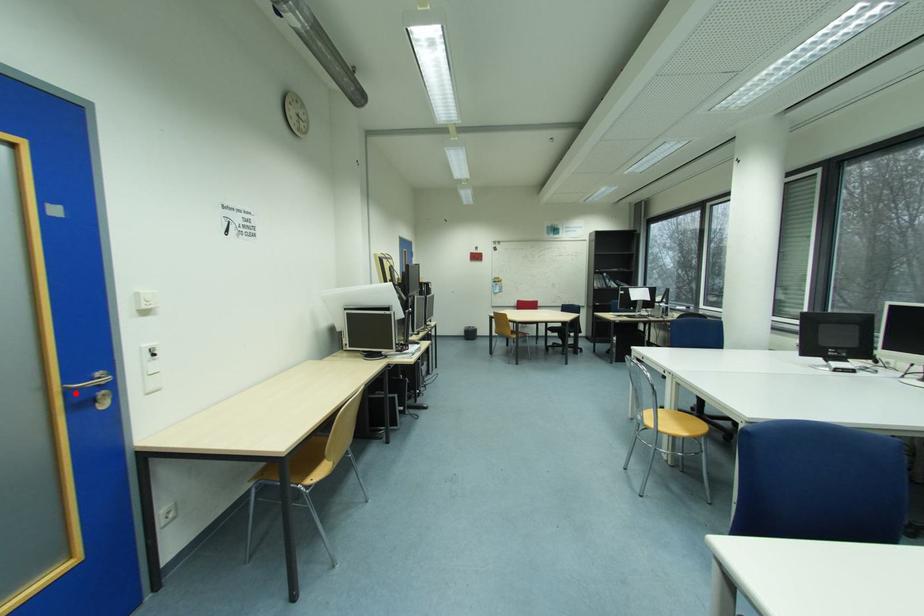
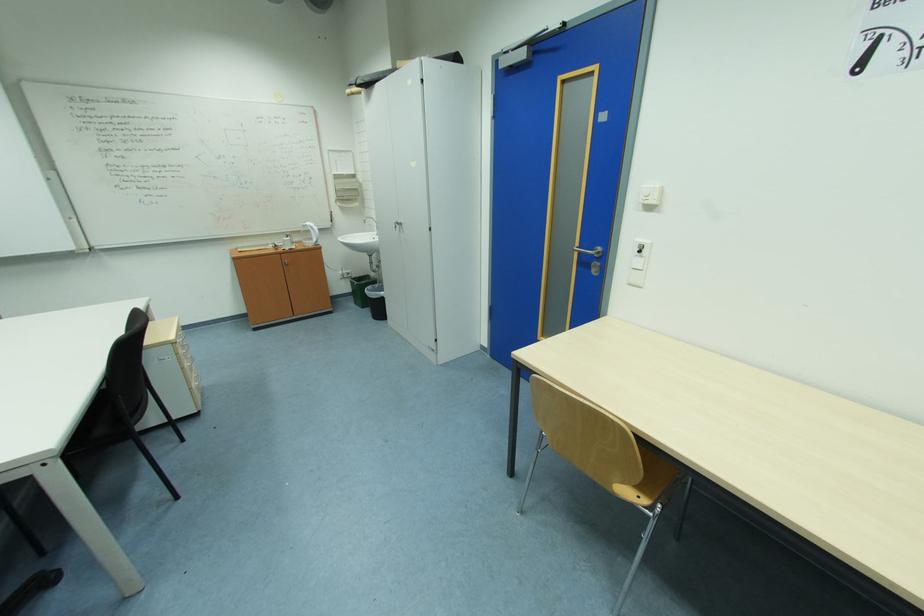
Where in the second image is the point corresponding to the highlighted location from the first image?

(587, 253)